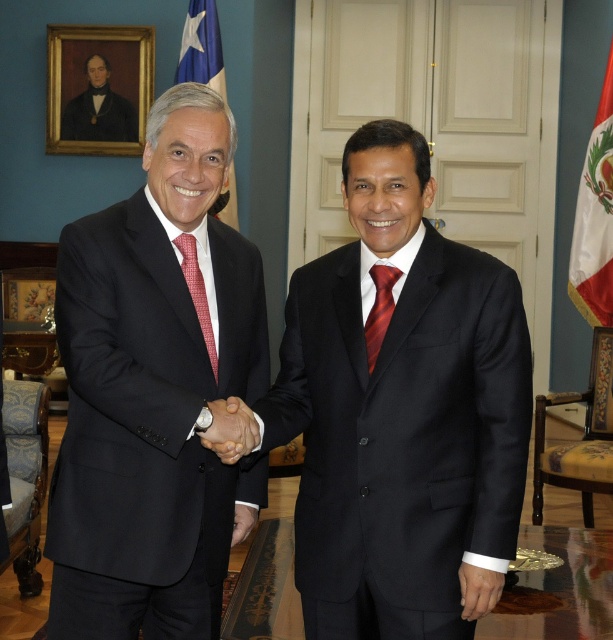
Is point (232, 388) positioned before point (232, 429)?

No, it is behind (232, 429).

Does matte black suit at center appear on the left side of matte black hand at center?

Correct, you'll find matte black suit at center to the left of matte black hand at center.

Does point (115, 484) come closer to viewer compared to point (223, 424)?

No, it is behind (223, 424).

Where is `matte black suit at center`? matte black suit at center is located at coordinates (154, 390).

Describe the element at coordinates (402, 412) in the screenshot. I see `black matte suit at center` at that location.

Which is behind, point (435, 509) or point (202, 68)?

Point (202, 68)

Locate an element on the screen. This screenshot has height=640, width=613. black matte suit at center is located at coordinates (402, 412).

Which of these two, black matte suit at center or white fabric flag at right, stands taller?

With more height is white fabric flag at right.

Can you confirm if black matte suit at center is wider than white fabric flag at right?

Yes, black matte suit at center is wider than white fabric flag at right.

What are the coordinates of `black matte suit at center` in the screenshot? It's located at (402, 412).